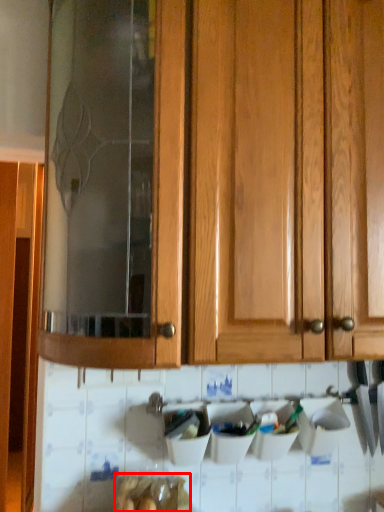
Question: From the image's perspective, where is food (annotated by the red box) located relative to cabinetry?

Choices:
 (A) above
 (B) below

Answer: (B)